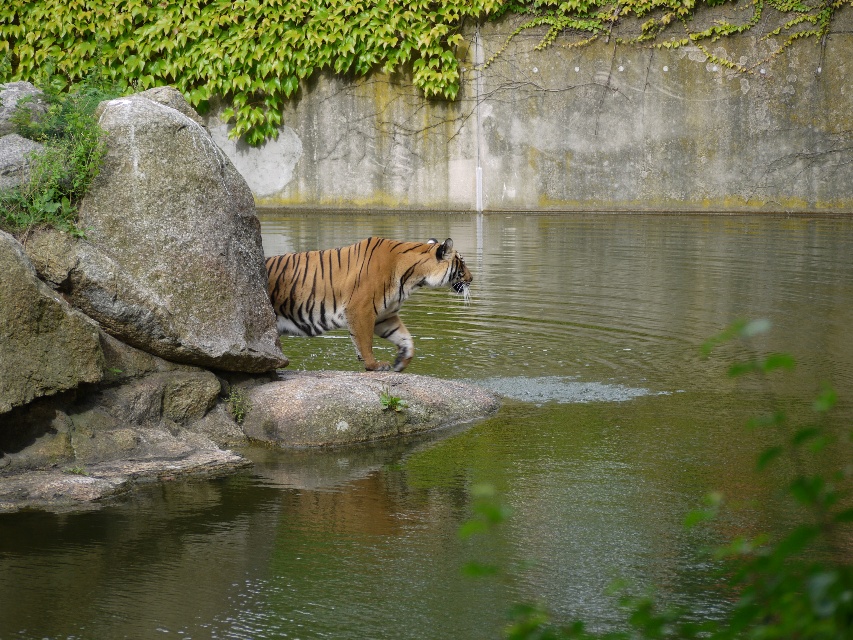
Who is more forward, (303, 452) or (376, 253)?

Point (303, 452) is more forward.

I want to click on green liquid water at center, so click(x=486, y=445).

Which is in front, point (570, 336) or point (373, 262)?

Point (373, 262)

Locate an element on the screen. Image resolution: width=853 pixels, height=640 pixels. green liquid water at center is located at coordinates (486, 445).

Between point (416, 307) and point (383, 1), which one is positioned in front?

Positioned in front is point (416, 307).

Is green liquid water at center shorter than green leafy ivy at upper center?

Yes, green liquid water at center is shorter than green leafy ivy at upper center.

Find the location of `green liquid water at center`. green liquid water at center is located at coordinates (486, 445).

Where is `green liquid water at center`? The height and width of the screenshot is (640, 853). green liquid water at center is located at coordinates [486, 445].

Between point (354, 70) and point (288, 284), which one is positioned behind?

Positioned behind is point (354, 70).

Which is below, green leafy ivy at upper center or orange striped tiger at center?

orange striped tiger at center is below.

The image size is (853, 640). Find the location of `green leafy ivy at upper center`. green leafy ivy at upper center is located at coordinates (335, 40).

Locate an element on the screen. This screenshot has width=853, height=640. green leafy ivy at upper center is located at coordinates [x=335, y=40].